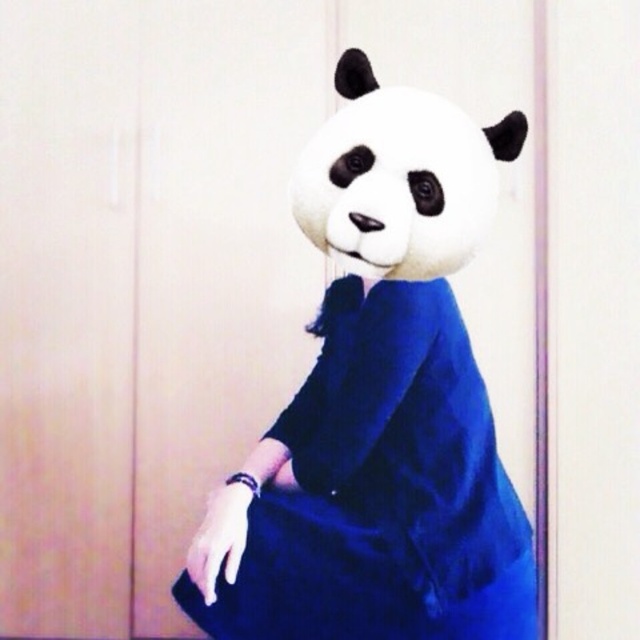
Question: Which point is closer to the camera?

Choices:
 (A) (x=444, y=227)
 (B) (x=490, y=516)

Answer: (A)

Question: Where is velvet blue dress at center located in relation to white plush panda at center in the image?

Choices:
 (A) above
 (B) below

Answer: (B)

Question: Which point is closer to the camera?

Choices:
 (A) (349, 208)
 (B) (468, 445)

Answer: (A)

Question: Can you confirm if velvet blue dress at center is wider than white plush panda at center?

Choices:
 (A) yes
 (B) no

Answer: (A)

Question: Observing the image, what is the correct spatial positioning of velvet blue dress at center in reference to white plush panda at center?

Choices:
 (A) left
 (B) right

Answer: (A)